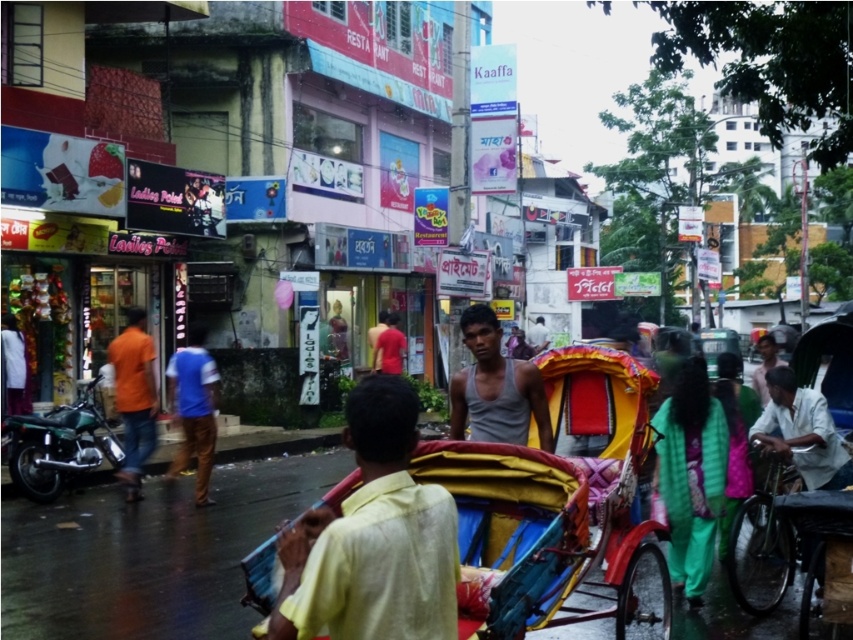
Who is positioned more to the right, white cotton shirt at right or gray cotton shirt at center?

Positioned to the right is gray cotton shirt at center.

Between white cotton shirt at right and gray cotton shirt at center, which one has less height?

Standing shorter between the two is white cotton shirt at right.

Identify the location of white cotton shirt at right. coord(802,432).

Can you confirm if gray matte tank top at center is bigger than orange cotton shirt at left?

Actually, gray matte tank top at center might be smaller than orange cotton shirt at left.

Consider the image. Does gray matte tank top at center have a greater height compared to orange cotton shirt at left?

In fact, gray matte tank top at center may be shorter than orange cotton shirt at left.

Between point (450, 433) and point (138, 467), which one is positioned behind?

The point (138, 467) is behind.

Locate an element on the screen. The width and height of the screenshot is (853, 640). gray matte tank top at center is located at coordinates (495, 387).

Is light yellow cotton shirt at center shorter than orange cotton shirt at left?

Indeed, light yellow cotton shirt at center has a lesser height compared to orange cotton shirt at left.

Which is behind, point (354, 531) or point (143, 339)?

Positioned behind is point (143, 339).

Does point (317, 522) come behind point (129, 445)?

No, it is not.

Image resolution: width=853 pixels, height=640 pixels. What are the coordinates of `light yellow cotton shirt at center` in the screenshot? It's located at pyautogui.click(x=373, y=538).